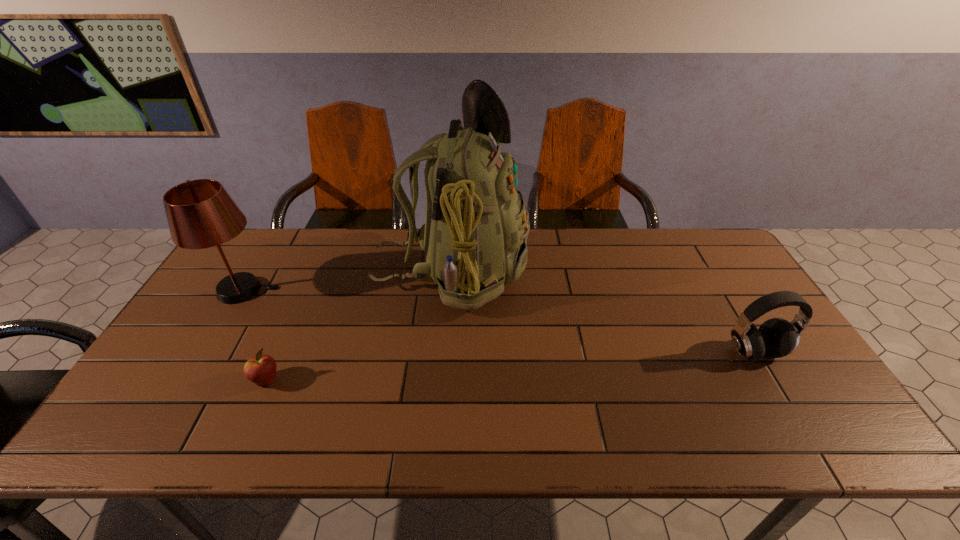
The image size is (960, 540). In order to click on the tallest object in this screenshot , I will do `click(474, 238)`.

Where is `the third object from left to right`? The image size is (960, 540). the third object from left to right is located at coordinates (474, 238).

This screenshot has height=540, width=960. I want to click on the third shortest object, so click(x=201, y=214).

This screenshot has height=540, width=960. In order to click on the leftmost object in this screenshot , I will do `click(201, 214)`.

Where is `the second shortest object`? Image resolution: width=960 pixels, height=540 pixels. the second shortest object is located at coordinates (776, 337).

Locate an element on the screen. This screenshot has height=540, width=960. the rightmost object is located at coordinates (776, 337).

Image resolution: width=960 pixels, height=540 pixels. In order to click on the shortest object in this screenshot , I will do `click(261, 369)`.

You are a GUI agent. You are given a task and a screenshot of the screen. Output one action in this format:
    pyautogui.click(x=<x>, y=<y>)
    Task: Click on the second object from left to right
    This screenshot has height=540, width=960.
    Given the screenshot: What is the action you would take?
    pyautogui.click(x=261, y=369)

Locate an element on the screen. The image size is (960, 540). vacant space located 0.210m on the front-facing side of the second object from right to left is located at coordinates (592, 273).

In order to click on blank area located 0.050m on the front-facing side of the leftmost object in this screenshot , I will do `click(293, 290)`.